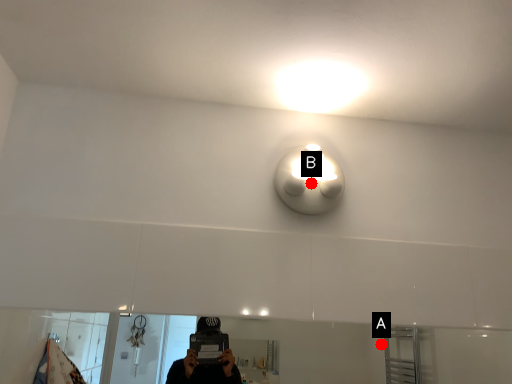
Question: Two points are circled on the image, labeled by A and B beside each circle. Which point is further to the camera?

Choices:
 (A) A is further
 (B) B is further

Answer: (A)